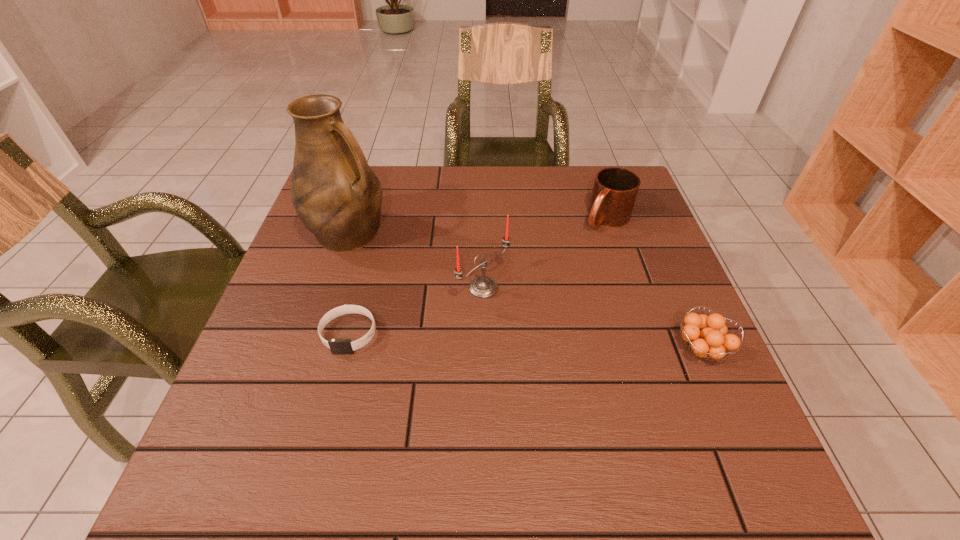
Locate an element on the screen. pitcher located at the left edge is located at coordinates (336, 195).

This screenshot has width=960, height=540. In order to click on orange fruit that is at the right edge in this screenshot , I will do `click(706, 336)`.

Where is `mug that is at the right edge`? The width and height of the screenshot is (960, 540). mug that is at the right edge is located at coordinates (615, 190).

This screenshot has width=960, height=540. What are the coordinates of `object present at the far left corner` in the screenshot? It's located at (336, 195).

This screenshot has height=540, width=960. I want to click on object at the far right corner, so click(x=615, y=190).

In the image, there is a desktop. Identify the location of vacant space at the far edge. The image size is (960, 540). (504, 205).

Where is `vacant region at the near edge of the desktop`? The image size is (960, 540). vacant region at the near edge of the desktop is located at coordinates (461, 390).

You are a GUI agent. You are given a task and a screenshot of the screen. Output one action in this format:
    pyautogui.click(x=<x>, y=<y>)
    Task: Click on the free spot at the left edge of the desktop
    This screenshot has width=960, height=540.
    Given the screenshot: What is the action you would take?
    pyautogui.click(x=306, y=283)

Where is `vacant point at the right edge`? The width and height of the screenshot is (960, 540). vacant point at the right edge is located at coordinates (649, 326).

Find the location of `vacant space at the near left corner`. vacant space at the near left corner is located at coordinates click(x=231, y=437).